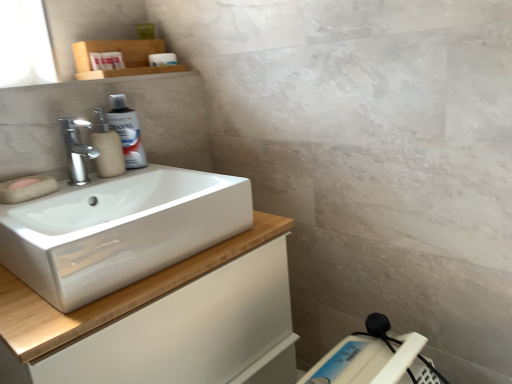
Question: Is beige matte soap dispenser at left located within polished chrome faucet at upper left?

Choices:
 (A) yes
 (B) no

Answer: (B)

Question: From a real-world perspective, is polished chrome faucet at upper left below beige matte soap dispenser at left?

Choices:
 (A) no
 (B) yes

Answer: (A)

Question: Does polished chrome faucet at upper left come in front of beige matte soap dispenser at left?

Choices:
 (A) yes
 (B) no

Answer: (A)

Question: Is the surface of polished chrome faucet at upper left in direct contact with beige matte soap dispenser at left?

Choices:
 (A) yes
 (B) no

Answer: (A)

Question: Is polished chrome faucet at upper left thinner than beige matte soap dispenser at left?

Choices:
 (A) yes
 (B) no

Answer: (A)

Question: From the image's perspective, is polished chrome faucet at upper left under beige matte soap dispenser at left?

Choices:
 (A) yes
 (B) no

Answer: (A)

Question: Is pink sponge at left further to the viewer compared to white plastic scale at lower right?

Choices:
 (A) no
 (B) yes

Answer: (B)

Question: Is pink sponge at left wider than white plastic scale at lower right?

Choices:
 (A) yes
 (B) no

Answer: (B)

Question: Is pink sponge at left placed right next to white plastic scale at lower right?

Choices:
 (A) yes
 (B) no

Answer: (B)

Question: Is pink sponge at left oriented towards white plastic scale at lower right?

Choices:
 (A) no
 (B) yes

Answer: (A)

Question: Does pink sponge at left come in front of white plastic scale at lower right?

Choices:
 (A) no
 (B) yes

Answer: (A)

Question: Can you confirm if pink sponge at left is smaller than white plastic scale at lower right?

Choices:
 (A) no
 (B) yes

Answer: (B)

Question: Is white glossy cabinet at lower left smaller than white plastic scale at lower right?

Choices:
 (A) yes
 (B) no

Answer: (B)